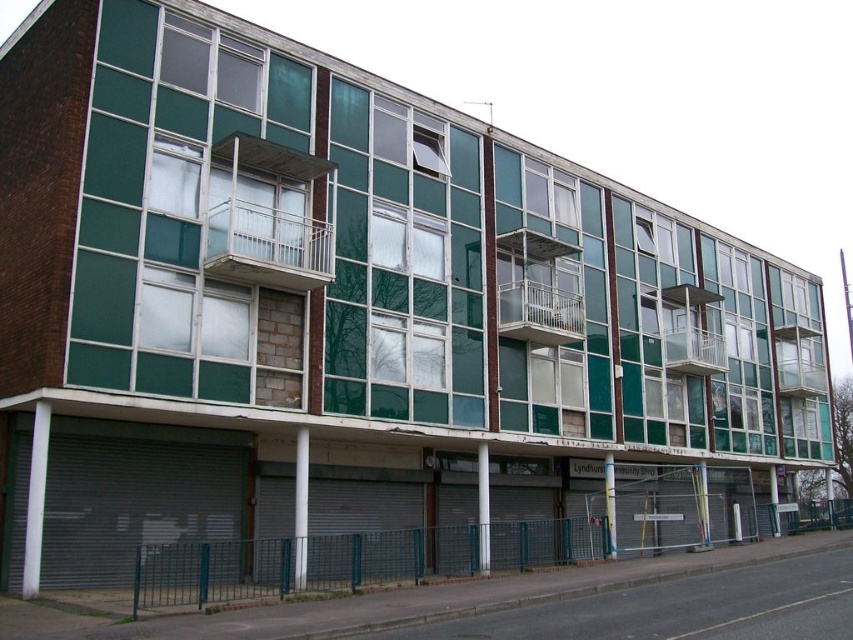
Based on the photo, you are standing in front of the building and want to reach the white metal balcony at upper center. Which balcony should you ascend from the white metal balcony at center?

The white metal balcony at upper center is located above the white metal balcony at center, so you should ascend from the white metal balcony at center to reach the white metal balcony at upper center.

You are standing at the base of the building and want to take a photo of the white metal balcony at upper center. If your camera can focus on objects up to 60 feet away, will it be able to capture the balcony clearly?

The white metal balcony at upper center is 58.35 feet away from the camera, which is within the camera focus range of up to 60 feet. Therefore, the camera can capture the balcony clearly.

You are a window cleaner who needs to clean all the balconies in the building. You have a ladder that can reach up to 10 meters. The white metal balcony at center is located at 8 meters height, and the metallic silver balcony at upper right is at 12 meters height. Can you safely clean both balconies with your current ladder?

The white metal balcony at center is at 8 meters height, which is within the ladder reach. However, the metallic silver balcony at upper right is at 12 meters height, exceeding the ladder capacity. Therefore, you can clean the white metal balcony at center but not the metallic silver balcony at upper right.